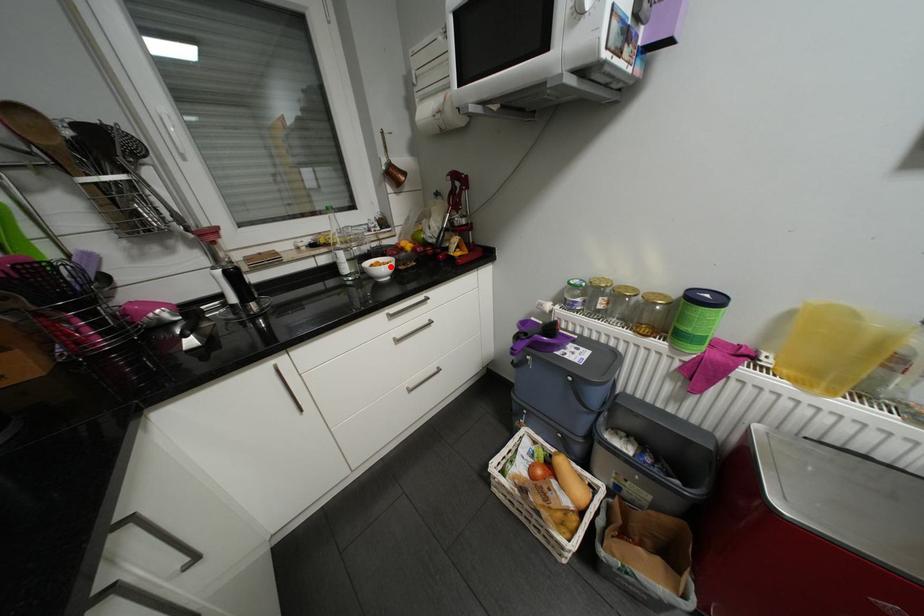
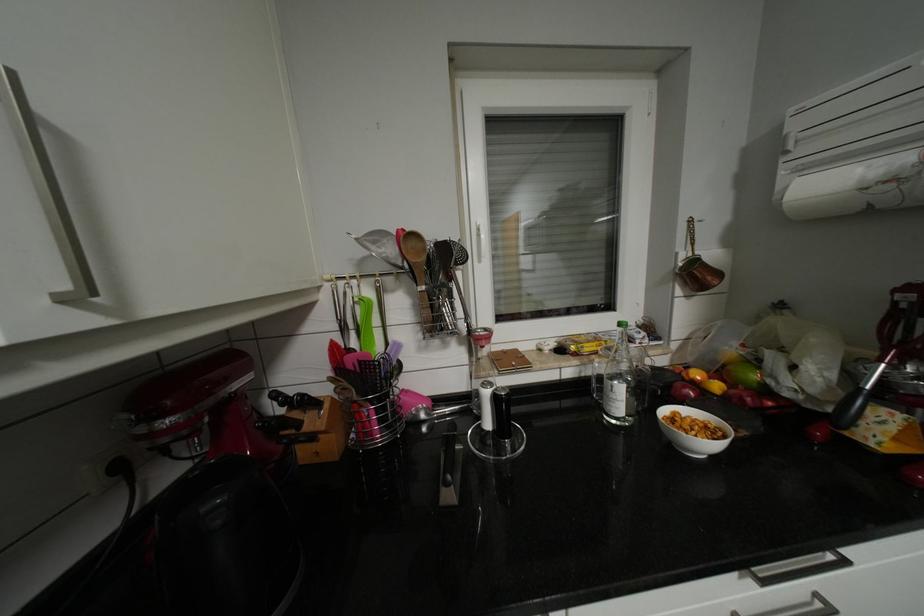
Question: I am providing you with two images of the same scene from different viewpoints. Image1 has a red point marked. In image2, the corresponding 3D location appears at what relative position? Reply with the corresponding letter.

Choices:
 (A) Closer
 (B) Farther

Answer: (B)